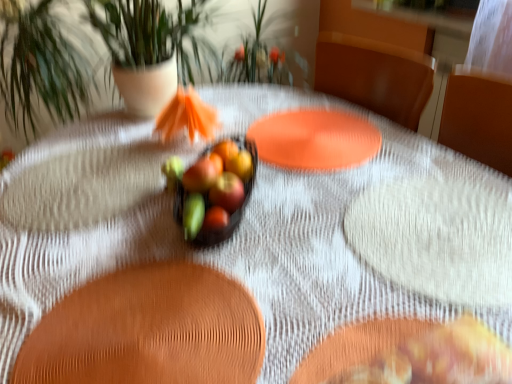
The width and height of the screenshot is (512, 384). Find the location of `free space to the left of glossy red apple at center, the second apple in the back-to-front sequence`. free space to the left of glossy red apple at center, the second apple in the back-to-front sequence is located at coordinates (132, 218).